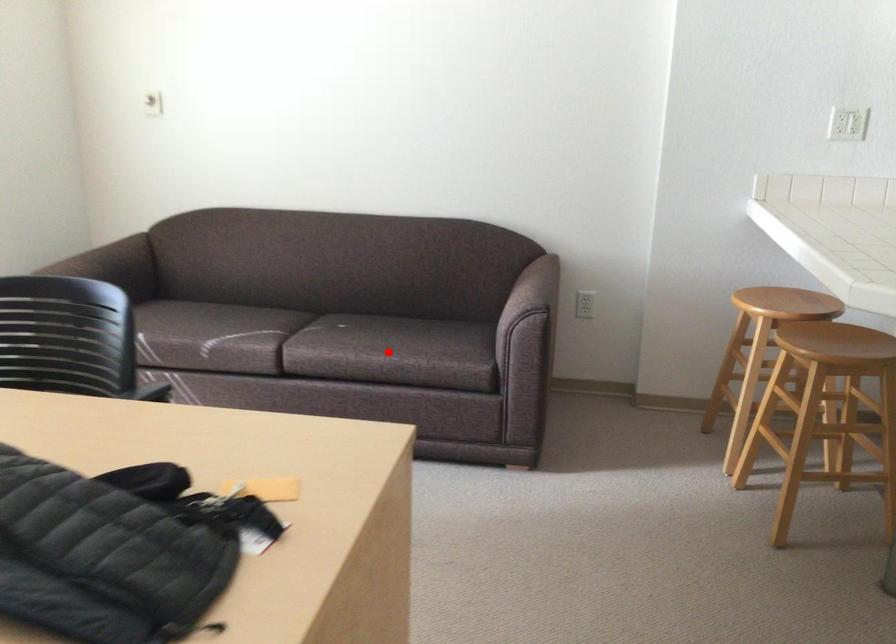
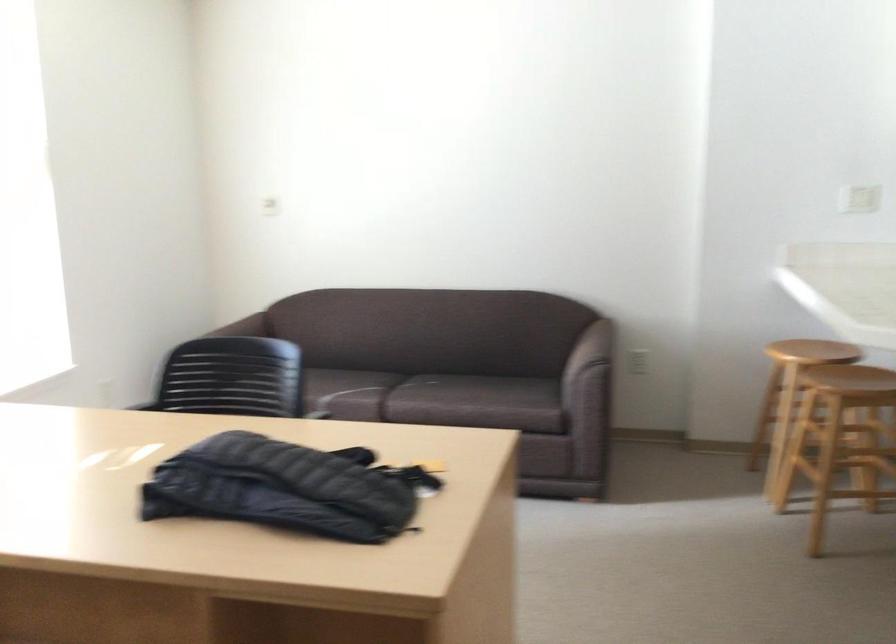
Question: I am providing you with two images of the same scene from different viewpoints. A red point is marked on the first image. At the location where the point appears in image 1, is it still visible in image 2?

Choices:
 (A) Yes
 (B) No

Answer: (A)